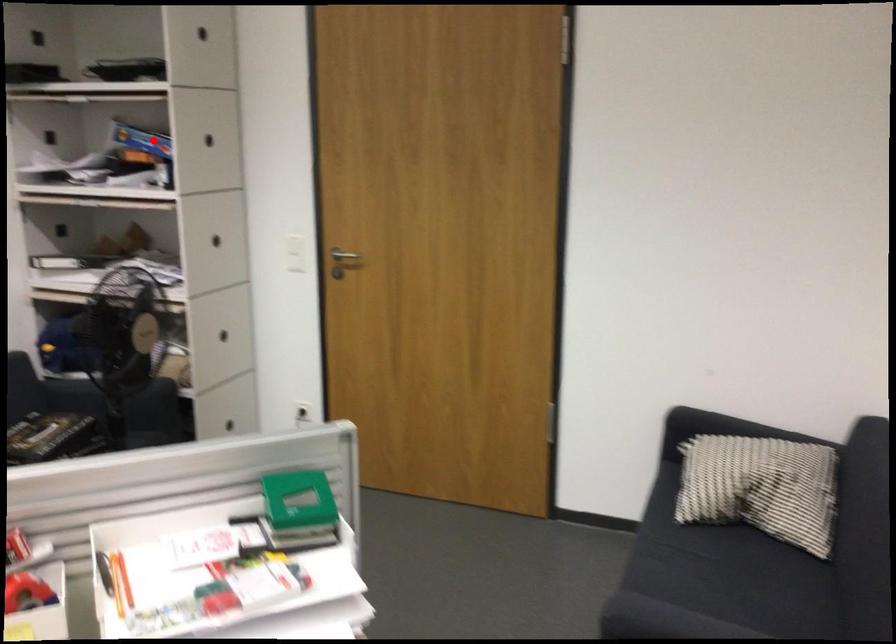
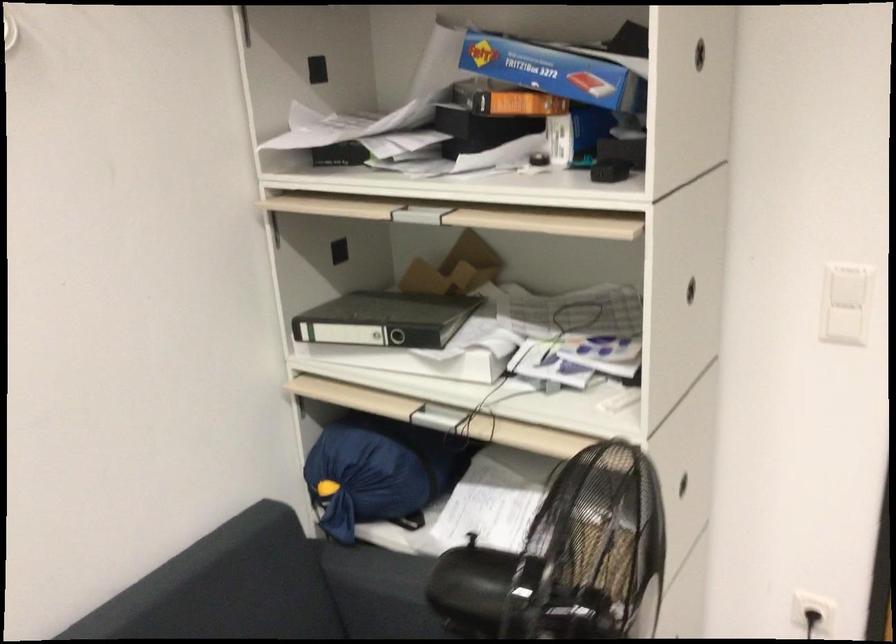
Question: A red point is marked in image1. In image2, is the corresponding 3D point closer to the camera or farther? Reply with the corresponding letter.

Choices:
 (A) The corresponding 3D point is closer.
 (B) The corresponding 3D point is farther.

Answer: (A)